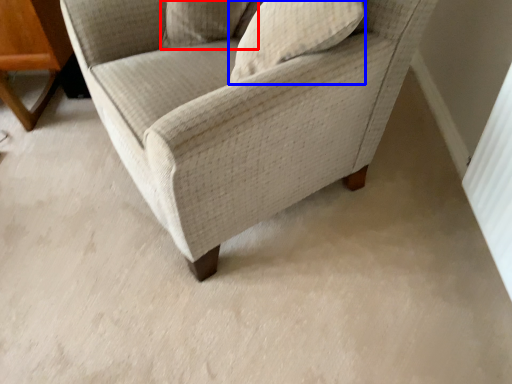
Question: Which of the following is the closest to the observer, pillow (highlighted by a red box) or pillow (highlighted by a blue box)?

Choices:
 (A) pillow
 (B) pillow

Answer: (B)